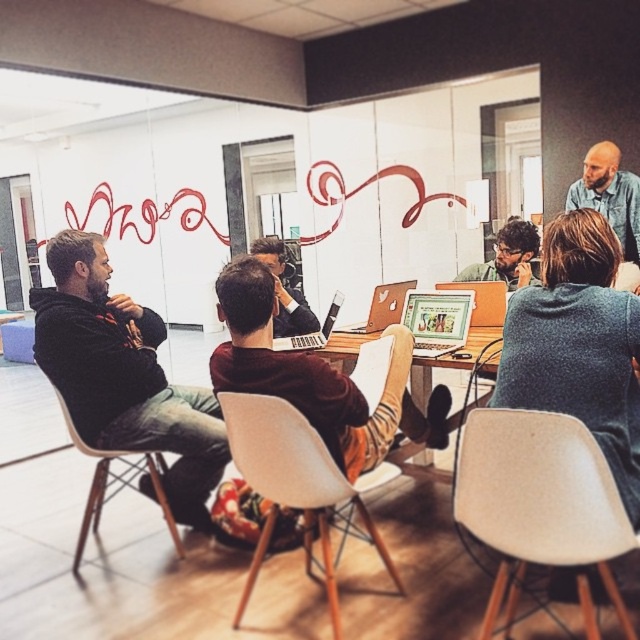
Who is more distant from viewer, [493,588] or [625,200]?

Positioned behind is point [625,200].

Who is more forward, (547, 436) or (628, 230)?

Point (547, 436)

This screenshot has width=640, height=640. Describe the element at coordinates (538, 500) in the screenshot. I see `white plastic chair at lower right` at that location.

The image size is (640, 640). I want to click on white plastic chair at lower right, so click(x=538, y=500).

Between white plastic chair at left and metallic silver laptop at center, which one has more height?

With more height is white plastic chair at left.

Does point (99, 513) lie behind point (444, 337)?

Yes.

Find the location of a particular element. This screenshot has width=640, height=640. white plastic chair at left is located at coordinates (115, 483).

Is black hoodie at left to the left of white plastic chair at lower right from the viewer's perspective?

Yes, black hoodie at left is to the left of white plastic chair at lower right.

From the picture: Is black hoodie at left further to camera compared to white plastic chair at lower right?

Yes, black hoodie at left is further from the viewer.

Identify the location of black hoodie at left. The width and height of the screenshot is (640, 640). [x=124, y=374].

The height and width of the screenshot is (640, 640). Find the location of `black hoodie at left`. black hoodie at left is located at coordinates (124, 374).